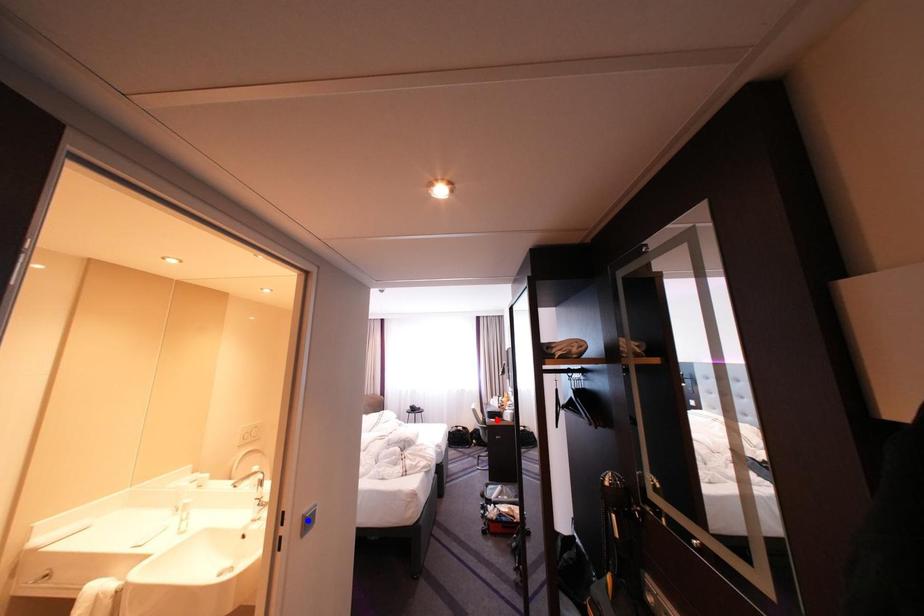
Question: Two points are marked on the image. Which point is closer to the camera?

Choices:
 (A) Blue point is closer.
 (B) Red point is closer.

Answer: (A)